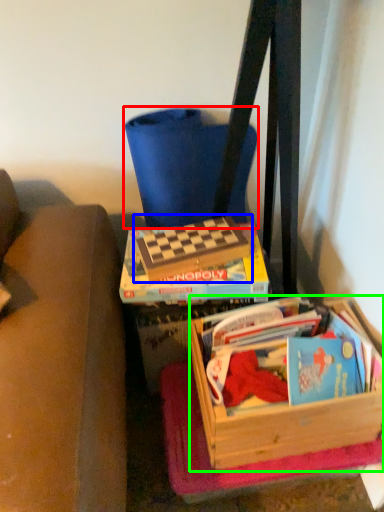
Question: Estimate the real-world distances between objects in this image. Which object is farther from folding chair (highlighted by a red box), paperback book (highlighted by a blue box) or box (highlighted by a green box)?

Choices:
 (A) paperback book
 (B) box

Answer: (B)